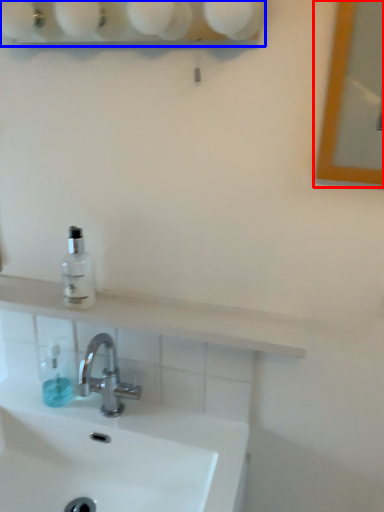
Question: Among these objects, which one is nearest to the camera, mirror (highlighted by a red box) or shelf (highlighted by a blue box)?

Choices:
 (A) mirror
 (B) shelf

Answer: (A)